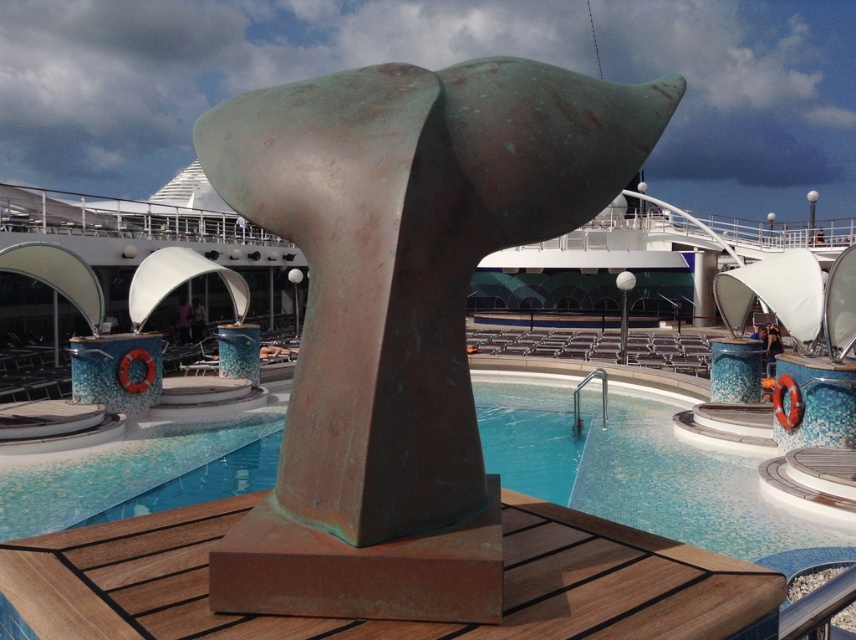
You are standing on the cruise ship deck and want to take a photo of the green patina sculpture at center. If your camera has a minimum focusing distance of 1.5 meters, will you need to step back to ensure it focuses properly?

The green patina sculpture at center is 1.29 meters from viewer. Since the minimum focusing distance is 1.5 meters, you need to step back further to be at least 1.5 meters away for the camera to focus properly.

You are a photographer planning to capture the green patina sculpture at center and the rustic wood deck at center in a single frame. Given that your camera can only focus on one object at a time, which object should you prioritize focusing on to ensure it appears larger in the photo?

The green patina sculpture at center is bigger than the rustic wood deck at center, so you should prioritize focusing on the green patina sculpture at center to ensure it appears larger in the photo.

You are a photographer planning to take a wide shot of the cruise ship deck. You need to ensure both the green patina sculpture at center and the rustic wood deck at center are clearly visible in the frame. Considering their sizes, which object might require more careful framing to avoid being overshadowed?

The green patina sculpture at center is thinner than the rustic wood deck at center, so it might require more careful framing to avoid being overshadowed by the larger deck.